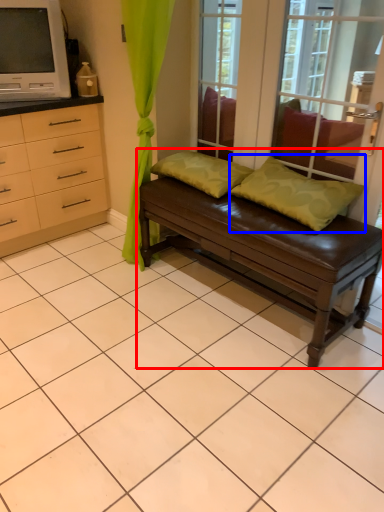
Question: Which point is further to the camera, studio couch (highlighted by a red box) or pillow (highlighted by a blue box)?

Choices:
 (A) studio couch
 (B) pillow

Answer: (B)